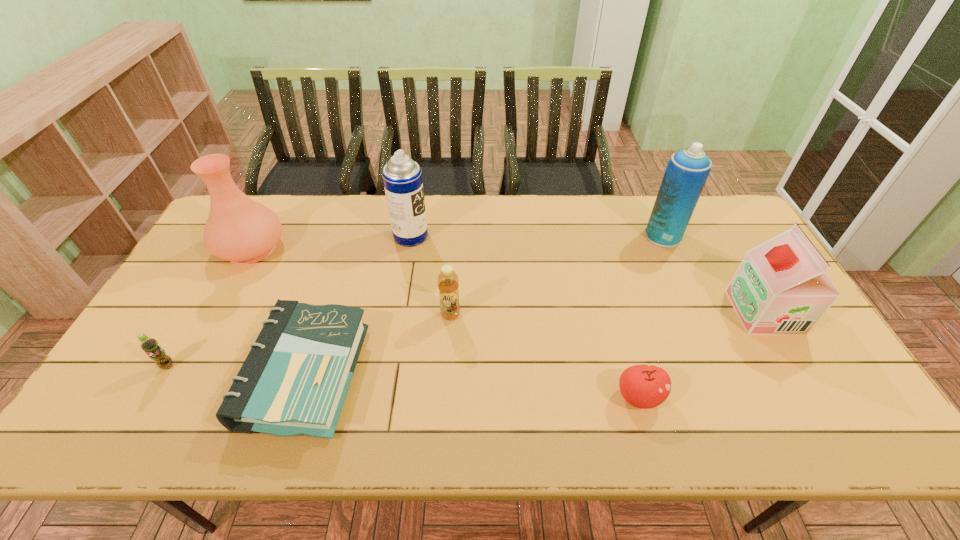
This screenshot has height=540, width=960. Identify the location of blank space located 0.330m on the right of the shortest object. (493, 374).

I want to click on vase that is positioned at the far edge, so click(x=240, y=230).

Locate an element on the screen. Image resolution: width=960 pixels, height=540 pixels. apple that is at the near edge is located at coordinates (643, 386).

You are a GUI agent. You are given a task and a screenshot of the screen. Output one action in this format:
    pyautogui.click(x=<x>, y=<y>)
    Task: Click on the paperback book located at the near edge
    
    Given the screenshot: What is the action you would take?
    [294, 381]

The width and height of the screenshot is (960, 540). Find the location of `vase located in the left edge section of the desktop`. vase located in the left edge section of the desktop is located at coordinates (240, 230).

The height and width of the screenshot is (540, 960). Find the location of `soda positioned at the left edge`. soda positioned at the left edge is located at coordinates (150, 346).

Locate an element on the screen. The image size is (960, 540). object present at the right edge is located at coordinates (781, 287).

This screenshot has width=960, height=540. Find the location of `object that is at the far left corner`. object that is at the far left corner is located at coordinates (240, 230).

Image resolution: width=960 pixels, height=540 pixels. In the image, there is a desktop. Identify the location of free region at the far edge. (304, 205).

Find the location of `vacant space at the near edge of the desktop`. vacant space at the near edge of the desktop is located at coordinates (590, 428).